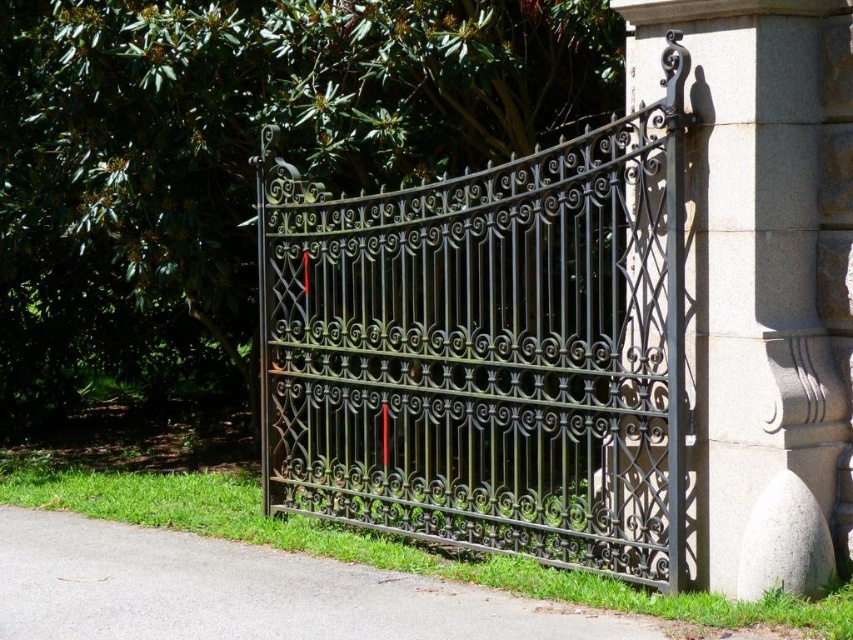
From the picture: You are a painter standing at the entrance of the gate. You want to paint both the black wrought iron gate at center and the gray stone pillar at center right. Which object should you look up to paint?

The gray stone pillar at center right is taller than the black wrought iron gate at center, so you should look up to paint the gray stone pillar at center right.

You are a delivery person approaching the entrance of a property. You see the black wrought iron gate at center and the gray stone pillar at center right. Which object is located closer to the entrance from your perspective?

The black wrought iron gate at center is positioned under the gray stone pillar at center right, so the gate is closer to the entrance than the pillar.